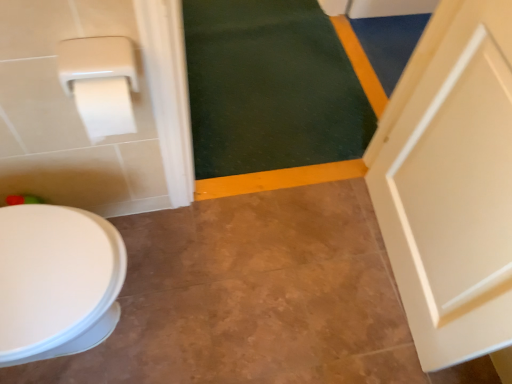
Question: From a real-world perspective, is dark green carpet at upper center physically located above or below white matte toilet paper at upper left?

Choices:
 (A) above
 (B) below

Answer: (B)

Question: In terms of height, does dark green carpet at upper center look taller or shorter compared to white matte toilet paper at upper left?

Choices:
 (A) tall
 (B) short

Answer: (B)

Question: Considering their positions, is dark green carpet at upper center located in front of or behind white matte toilet paper at upper left?

Choices:
 (A) front
 (B) behind

Answer: (B)

Question: From their relative heights in the image, would you say white matte toilet paper at upper left is taller or shorter than dark green carpet at upper center?

Choices:
 (A) tall
 (B) short

Answer: (A)

Question: In terms of size, does white matte toilet paper at upper left appear bigger or smaller than dark green carpet at upper center?

Choices:
 (A) small
 (B) big

Answer: (A)

Question: In terms of width, does white matte toilet paper at upper left look wider or thinner when compared to dark green carpet at upper center?

Choices:
 (A) wide
 (B) thin

Answer: (B)

Question: Based on their positions, is white matte toilet paper at upper left located to the left or right of dark green carpet at upper center?

Choices:
 (A) left
 (B) right

Answer: (A)